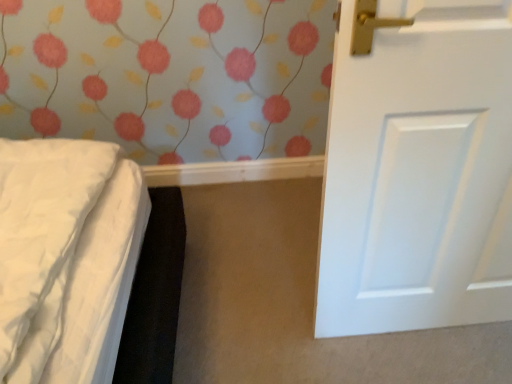
This screenshot has height=384, width=512. What are the coordinates of `blank space to the left of white matte door at right` in the screenshot? It's located at (280, 311).